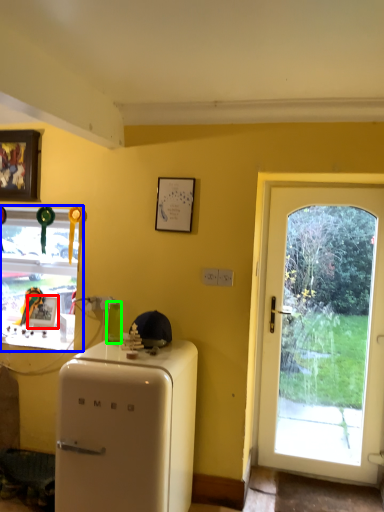
Question: Considering the real-world distances, which object is closest to picture frame (highlighted by a red box)? window (highlighted by a blue box) or bottle (highlighted by a green box).

Choices:
 (A) window
 (B) bottle

Answer: (A)